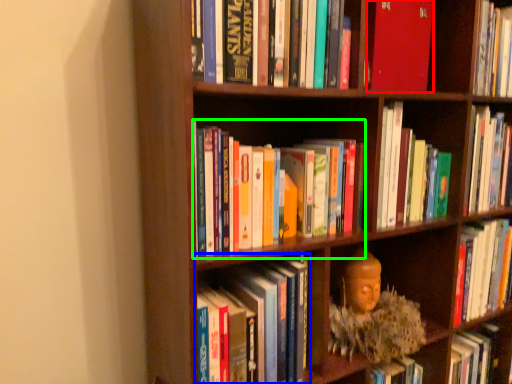
Question: Which object is the farthest from book (highlighted by a red box)? Choose among these: book (highlighted by a blue box) or book (highlighted by a green box).

Choices:
 (A) book
 (B) book

Answer: (A)